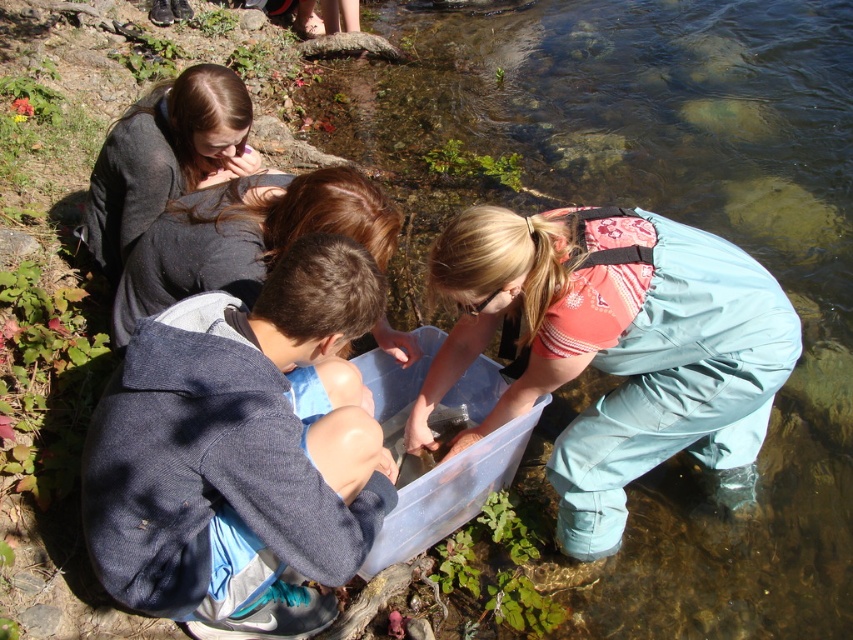
Does blue fleece jacket at lower left have a lesser width compared to matte gray hoodie at upper left?

Indeed, blue fleece jacket at lower left has a lesser width compared to matte gray hoodie at upper left.

Which is behind, point (132, 458) or point (252, 211)?

The point (252, 211) is behind.

Locate an element on the screen. The image size is (853, 640). blue fleece jacket at lower left is located at coordinates (241, 451).

Does matte gray hoodie at upper left appear on the left side of dark gray fabric at upper left?

No, matte gray hoodie at upper left is not to the left of dark gray fabric at upper left.

Does matte gray hoodie at upper left have a lesser height compared to dark gray fabric at upper left?

Yes, matte gray hoodie at upper left is shorter than dark gray fabric at upper left.

At what (x,y) coordinates should I click in order to perform the action: click on matte gray hoodie at upper left. Please return your answer as a coordinate pair (x, y). The width and height of the screenshot is (853, 640). Looking at the image, I should click on (245, 236).

Does blue fleece jacket at lower left have a greater height compared to dark gray fabric at upper left?

Yes.

Is blue fleece jacket at lower left thinner than dark gray fabric at upper left?

Yes, blue fleece jacket at lower left is thinner than dark gray fabric at upper left.

Identify the location of blue fleece jacket at lower left. (241, 451).

Locate an element on the screen. blue fleece jacket at lower left is located at coordinates (241, 451).